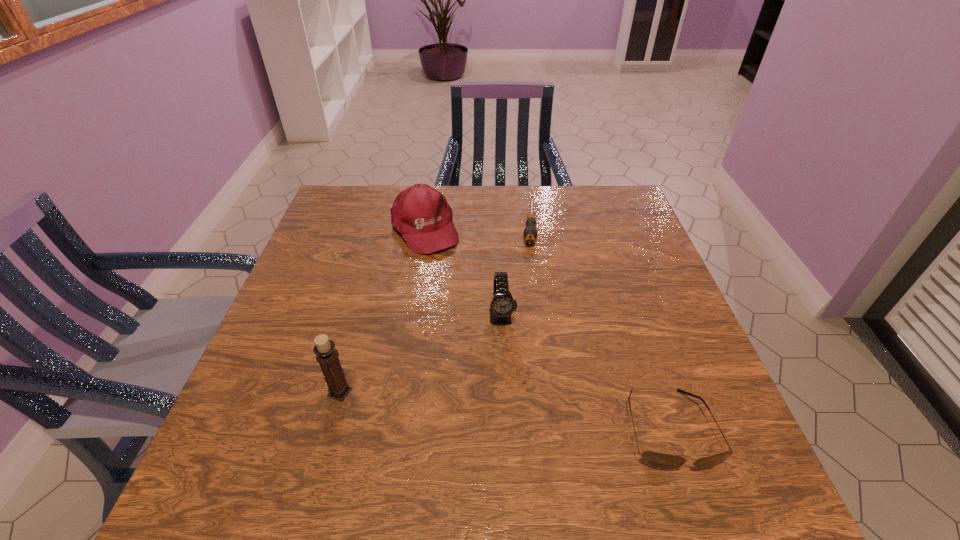
Identify which object is the fourth closest to the watch. Please provide its 2D coordinates. Your answer should be formatted as a tuple, i.e. [(x, y)], where the tuple contains the x and y coordinates of a point satisfying the conditions above.

[(326, 354)]

This screenshot has height=540, width=960. Find the location of `the closest object to the baseball cap`. the closest object to the baseball cap is located at coordinates (530, 233).

Identify the location of vacant space that satisfies the following two spatial constraints: 1. on the back side of the third farthest object; 2. on the left side of the tallest object. This screenshot has width=960, height=540. (361, 316).

Locate an element on the screen. This screenshot has height=540, width=960. free space that satisfies the following two spatial constraints: 1. on the front side of the third farthest object; 2. on the left side of the baseball cap is located at coordinates (410, 316).